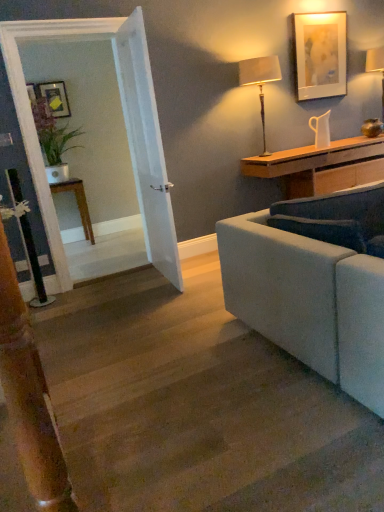
Question: Is matte white picture frame at upper right, which is the 1th picture frame in right-to-left order, shorter than white ceramic pitcher at upper right?

Choices:
 (A) no
 (B) yes

Answer: (A)

Question: Does matte white picture frame at upper right, which is the second picture frame in back-to-front order, have a larger size compared to white ceramic pitcher at upper right?

Choices:
 (A) no
 (B) yes

Answer: (B)

Question: Is white ceramic pitcher at upper right completely or partially inside matte white picture frame at upper right, arranged as the 1th picture frame when viewed from the front?

Choices:
 (A) yes
 (B) no

Answer: (B)

Question: From the image's perspective, does matte white picture frame at upper right, which is the 1th picture frame in right-to-left order, appear lower than white ceramic pitcher at upper right?

Choices:
 (A) yes
 (B) no

Answer: (B)

Question: From the image's perspective, would you say matte white picture frame at upper right, which is the 1th picture frame in right-to-left order, is positioned over white ceramic pitcher at upper right?

Choices:
 (A) no
 (B) yes

Answer: (B)

Question: From a real-world perspective, is matte white picture frame at upper right, arranged as the 1th picture frame when viewed from the front, positioned over white ceramic pitcher at upper right based on gravity?

Choices:
 (A) yes
 (B) no

Answer: (A)

Question: Considering the relative positions of wooden stairs at lower left and brown wooden table at left in the image provided, is wooden stairs at lower left to the right of brown wooden table at left from the viewer's perspective?

Choices:
 (A) yes
 (B) no

Answer: (A)

Question: From the image's perspective, is wooden stairs at lower left over brown wooden table at left?

Choices:
 (A) no
 (B) yes

Answer: (A)

Question: Considering the relative sizes of wooden stairs at lower left and brown wooden table at left in the image provided, is wooden stairs at lower left thinner than brown wooden table at left?

Choices:
 (A) yes
 (B) no

Answer: (B)

Question: Can you confirm if wooden stairs at lower left is bigger than brown wooden table at left?

Choices:
 (A) yes
 (B) no

Answer: (A)

Question: Would you say wooden stairs at lower left is outside brown wooden table at left?

Choices:
 (A) no
 (B) yes

Answer: (B)

Question: Does wooden stairs at lower left have a smaller size compared to brown wooden table at left?

Choices:
 (A) no
 (B) yes

Answer: (A)

Question: Is brown wooden table at left placed right next to white ceramic pitcher at upper right?

Choices:
 (A) yes
 (B) no

Answer: (B)